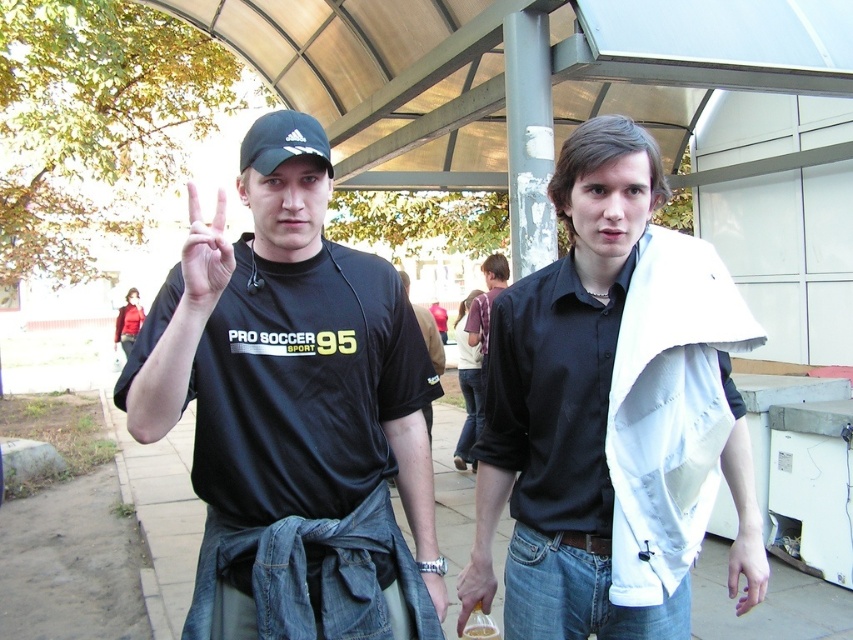
You are a photographer at the scene. You want to take a photo where both the black adidas cap at center and the matte plastic bottle at lower center are clearly visible. Which object should you focus on to ensure the shorter one is sharp?

The black adidas cap at center has a lesser height compared to the matte plastic bottle at lower center. Therefore, you should focus on the black adidas cap at center since it is shorter and closer to the camera.

You are a photographer at the scene. You need to adjust the lighting so that the white cotton shirt at center and the matte black hand at center are both well illuminated. Which object should you move closer to the light source to ensure proper exposure?

The matte black hand at center should be moved closer to the light source because it is positioned to the left of the white cotton shirt at center, which may be receiving more light due to its placement.

You are a photographer at the scene. You want to focus on the matte black hand at center and the matte plastic bottle at lower center. Which object should you adjust your camera focus on first if you want to ensure both are in focus?

The matte black hand at center is in front of the matte plastic bottle at lower center. To ensure both are in focus, you should focus on the matte plastic bottle at lower center first, as it is the farther object.